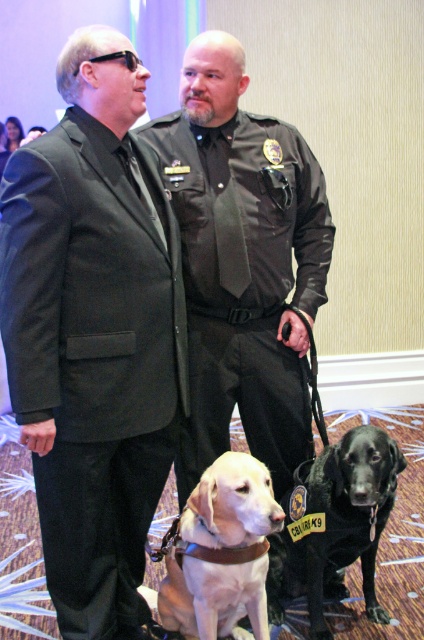
You are standing in the room and want to determine which of the two points, point (262,163) or point (342,524), is closer to you. Based on the image, which point is nearer?

Point (262,163) is further to the viewer than point (342,524), so the closer point is point (342,524).

You are a photographer who needs to capture a clear photo of both the light brown fur at center and the black matte dog at center. Based on their positions, which one might block the other in the photo?

The light brown fur at center is in front of the black matte dog at center, so it might block the black matte dog at center in the photo.

Based on the coordinates provided, what object is located at point (243, 280) in the scene?

The black leather uniform at center is located at point (243, 280).